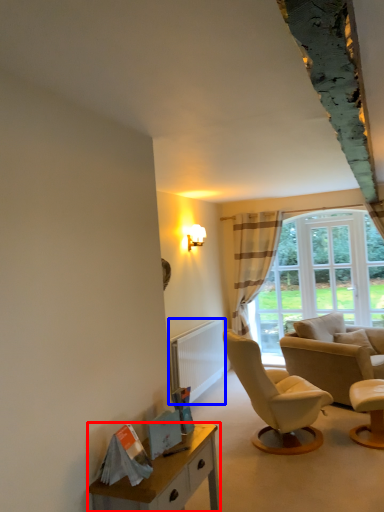
Question: Among these objects, which one is farthest to the camera, desk (highlighted by a red box) or radiator (highlighted by a blue box)?

Choices:
 (A) desk
 (B) radiator

Answer: (B)